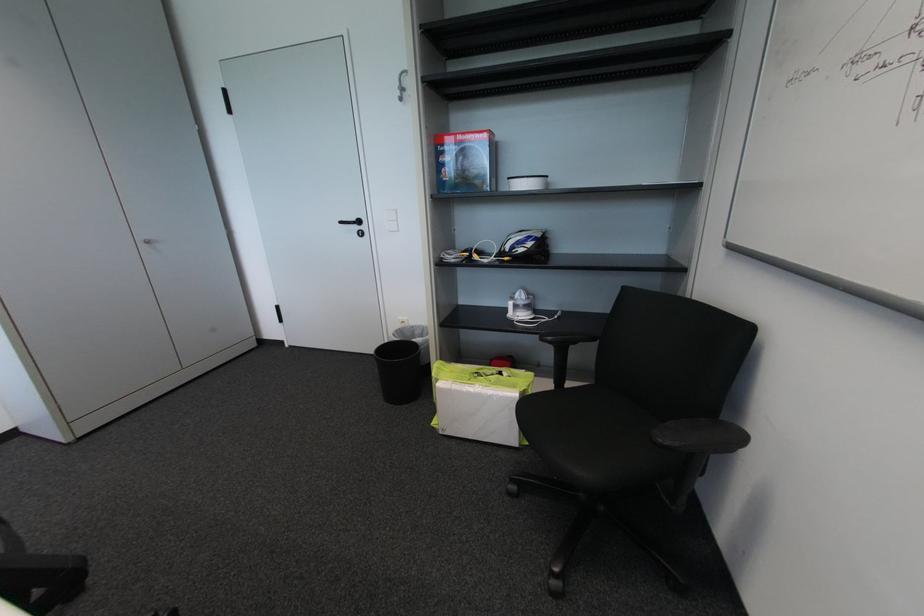
The height and width of the screenshot is (616, 924). I want to click on chair armrest, so click(x=711, y=436).